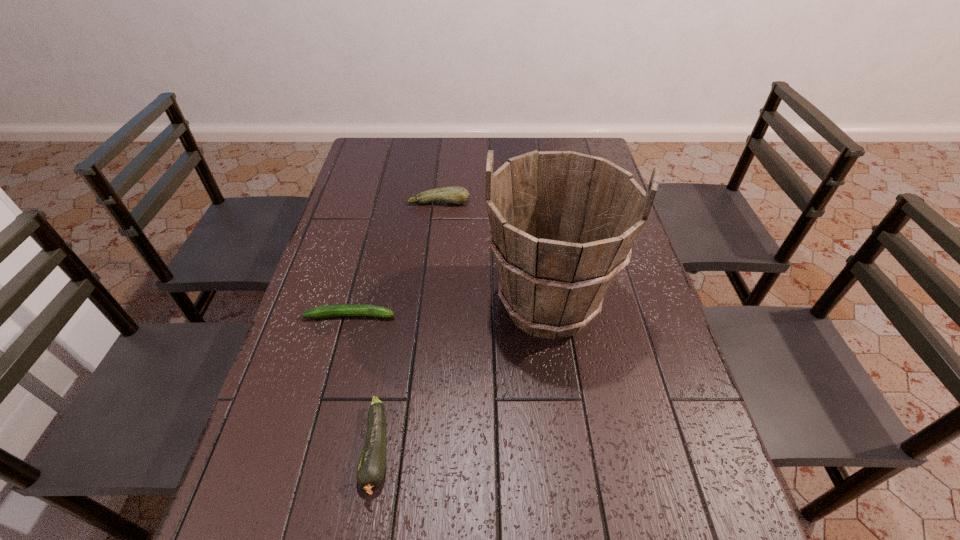
This screenshot has height=540, width=960. Find the location of `vacant area in the image that satisfies the following two spatial constraints: 1. on the front side of the tallest object; 2. on the front-facing side of the second farthest zucchini`. vacant area in the image that satisfies the following two spatial constraints: 1. on the front side of the tallest object; 2. on the front-facing side of the second farthest zucchini is located at coordinates (550, 315).